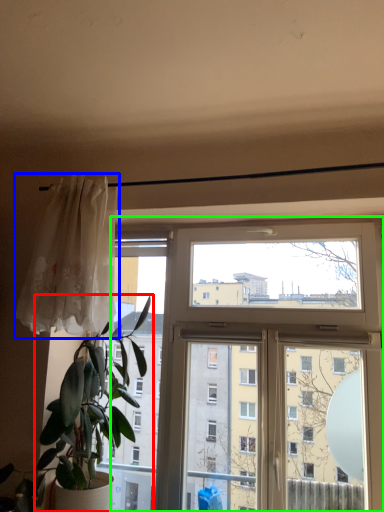
Question: Based on their relative distances, which object is farther from houseplant (highlighted by a red box)? Choose from curtain (highlighted by a blue box) and window (highlighted by a green box).

Choices:
 (A) curtain
 (B) window

Answer: (B)